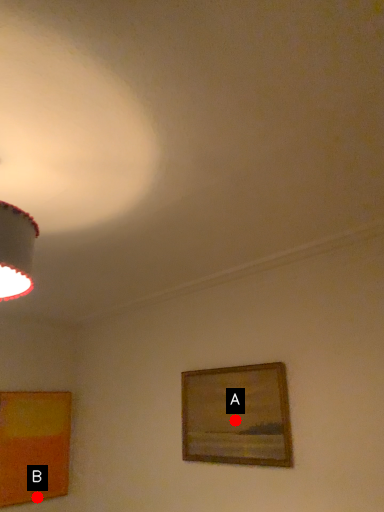
Question: Two points are circled on the image, labeled by A and B beside each circle. Which point is closer to the camera?

Choices:
 (A) A is closer
 (B) B is closer

Answer: (A)